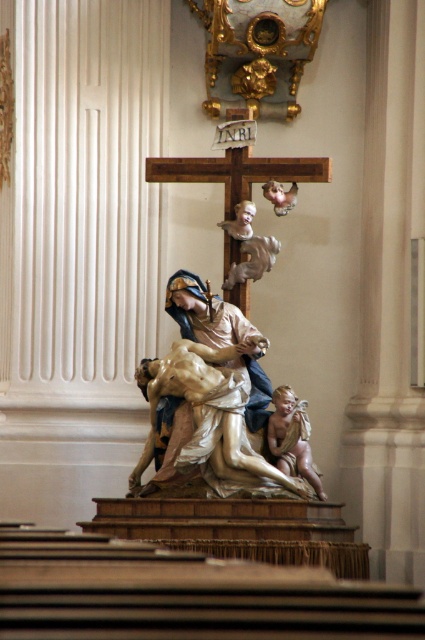
Question: Where is smooth beige cherub at center located in relation to polished silver cherub at upper center in the image?

Choices:
 (A) right
 (B) left

Answer: (A)

Question: Which is nearer to the polished silver cherub at upper center?

Choices:
 (A) smooth beige cherub at center
 (B) polished marble statue at center

Answer: (B)

Question: Does polished marble statue at center have a greater width compared to smooth beige cherub at center?

Choices:
 (A) no
 (B) yes

Answer: (A)

Question: Which of the following is the closest to the observer?

Choices:
 (A) (292, 420)
 (B) (166, 358)

Answer: (B)

Question: Estimate the real-world distances between objects in this image. Which object is closer to the smooth beige cherub at center?

Choices:
 (A) polished silver cherub at upper center
 (B) polished marble statue at center

Answer: (B)

Question: Is polished marble statue at center below smooth beige cherub at center?

Choices:
 (A) yes
 (B) no

Answer: (B)